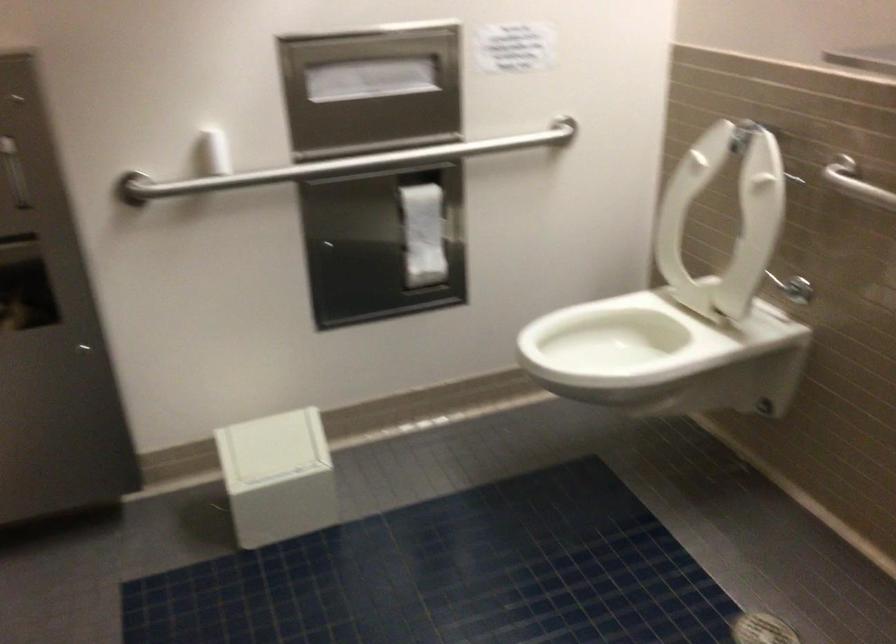
Find where to pull the toilet paper roll. Please return your answer as a coordinate pair (x, y).

(423, 234)